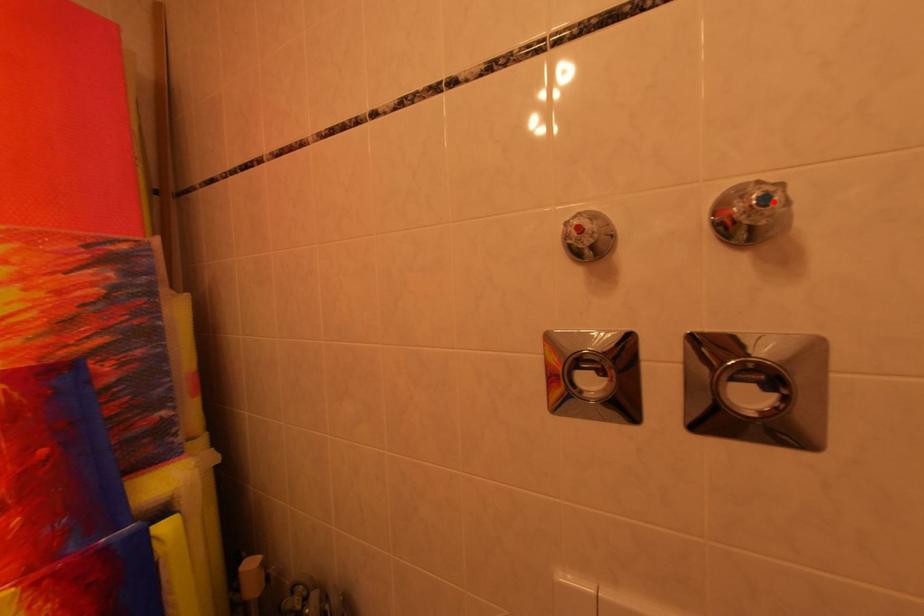
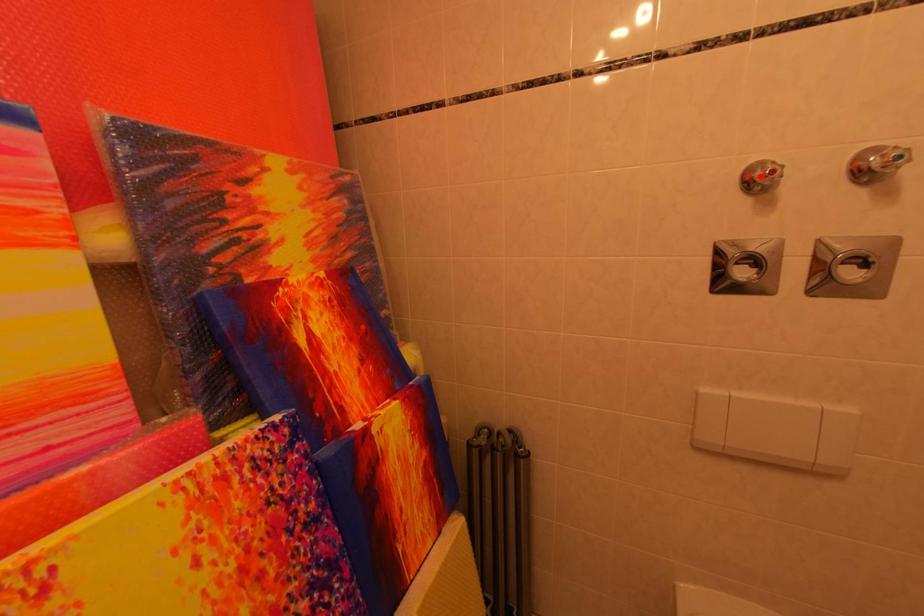
I am providing you with two images of the same scene from different viewpoints. A red point is marked on the first image and another point is marked on the second image. Does the point marked in image1 correspond to the same location as the one in image2?

No